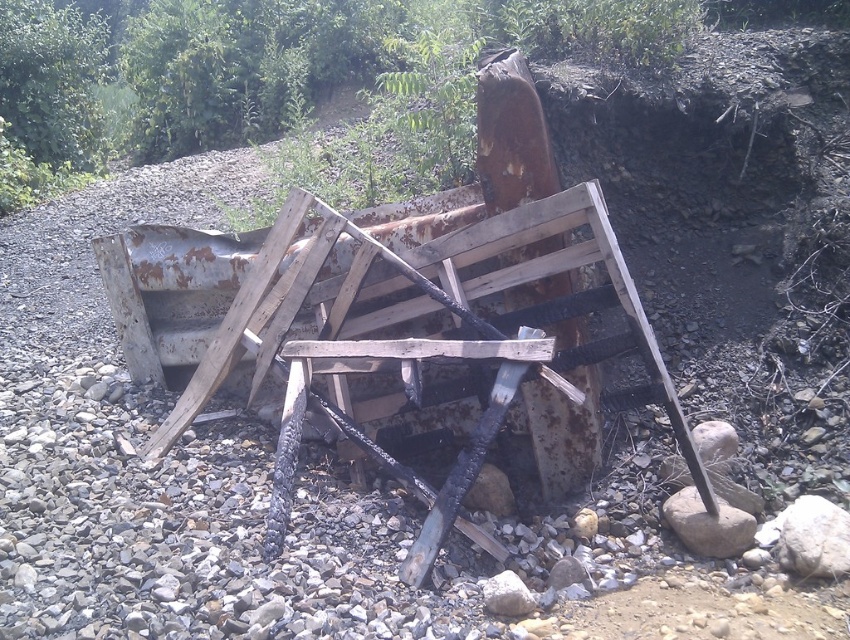
Between white smooth rock at lower right and rusty metal stone at center, which one is positioned higher?

Positioned higher is rusty metal stone at center.

Does point (817, 524) come farther from viewer compared to point (689, 534)?

No, it is in front of (689, 534).

Identify the location of white smooth rock at lower right. (814, 538).

Does rusty metal stone at center come behind smooth gray rock at center?

Yes.

Who is more distant from viewer, (667, 504) or (496, 595)?

The point (667, 504) is behind.

Who is more forward, (732, 522) or (507, 573)?

Point (507, 573) is more forward.

Locate an element on the screen. This screenshot has width=850, height=640. rusty metal stone at center is located at coordinates (707, 524).

Does white smooth rock at lower right have a smaller size compared to smooth gray rock at center?

No, white smooth rock at lower right is not smaller than smooth gray rock at center.

From the picture: Is white smooth rock at lower right below smooth gray rock at center?

No.

Does point (785, 552) come in front of point (517, 612)?

No, (785, 552) is behind (517, 612).

Where is `white smooth rock at lower right`? white smooth rock at lower right is located at coordinates (814, 538).